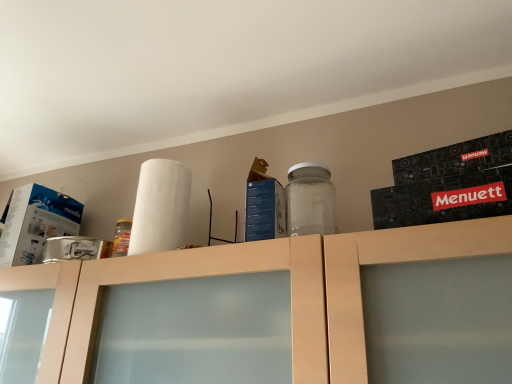
What are the coordinates of `blue cardboard box at center, which appears as the 2th box when viewed from the back` in the screenshot? It's located at (264, 205).

You are a GUI agent. You are given a task and a screenshot of the screen. Output one action in this format:
    pyautogui.click(x=<x>, y=<y>)
    Task: Click on the matte wood cabinet at upper center
    
    Given the screenshot: What is the action you would take?
    pyautogui.click(x=253, y=272)

The height and width of the screenshot is (384, 512). Identify the location of white matte paper towel at upper center. (160, 206).

The width and height of the screenshot is (512, 384). In order to click on white cardboard box at left, placed as the 1th box when sorted from back to front in this screenshot , I will do `click(36, 223)`.

The width and height of the screenshot is (512, 384). Identify the location of cabinetry that is below the white cardboard box at left, which appears as the 2th box when viewed from the front (from the image's perspective). (253, 272).

Considering the sizes of matte wood cabinet at upper center and white cardboard box at left, the first box in the left-to-right sequence, in the image, is matte wood cabinet at upper center taller or shorter than white cardboard box at left, the first box in the left-to-right sequence,?

In the image, matte wood cabinet at upper center appears to be taller than white cardboard box at left, the first box in the left-to-right sequence.

From the image's perspective, which one is positioned lower, matte wood cabinet at upper center or white cardboard box at left, placed as the 1th box when sorted from back to front?

matte wood cabinet at upper center, from the image's perspective.

Does point (309, 278) appear closer or farther from the camera than point (47, 215)?

Point (309, 278) appears to be closer to the viewer than point (47, 215).

This screenshot has height=384, width=512. What are the coordinates of `paper towel behind the blue cardboard box at center, the first box when ordered from front to back` in the screenshot? It's located at (160, 206).

Looking at the image, does white matte paper towel at upper center seem bigger or smaller compared to blue cardboard box at center, the first box when ordered from front to back?

Considering their sizes, white matte paper towel at upper center takes up more space than blue cardboard box at center, the first box when ordered from front to back.

From the picture: Who is bigger, blue cardboard box at center, which is counted as the 2th box, starting from the left, or matte wood cabinet at upper center?

With larger size is matte wood cabinet at upper center.

Considering the positions of objects blue cardboard box at center, which is counted as the 2th box, starting from the left, and matte wood cabinet at upper center in the image provided, who is more to the right, blue cardboard box at center, which is counted as the 2th box, starting from the left, or matte wood cabinet at upper center?

blue cardboard box at center, which is counted as the 2th box, starting from the left.

Who is shorter, blue cardboard box at center, which appears as the 2th box when viewed from the back, or matte wood cabinet at upper center?

Standing shorter between the two is blue cardboard box at center, which appears as the 2th box when viewed from the back.

Do you think blue cardboard box at center, which appears as the 2th box when viewed from the back, is within matte wood cabinet at upper center, or outside of it?

blue cardboard box at center, which appears as the 2th box when viewed from the back, is outside matte wood cabinet at upper center.

Who is shorter, matte wood cabinet at upper center or blue cardboard box at center, the first box from the right?

Standing shorter between the two is blue cardboard box at center, the first box from the right.

In the image, there is a blue cardboard box at center, which appears as the 2th box when viewed from the back. In order to click on cabinetry below it (from the image's perspective) in this screenshot , I will do `click(253, 272)`.

Is matte wood cabinet at upper center far away from blue cardboard box at center, which is counted as the 2th box, starting from the left?

No, matte wood cabinet at upper center is in close proximity to blue cardboard box at center, which is counted as the 2th box, starting from the left.

From a real-world perspective, relative to blue cardboard box at center, the first box when ordered from front to back, is matte wood cabinet at upper center vertically above or below?

In terms of real-world spatial position, matte wood cabinet at upper center is below blue cardboard box at center, the first box when ordered from front to back.

Which of these two, white cardboard box at left, the first box in the left-to-right sequence, or matte wood cabinet at upper center, is thinner?

white cardboard box at left, the first box in the left-to-right sequence, is thinner.

Which object is further away from the camera taking this photo, white cardboard box at left, positioned as the second box in right-to-left order, or matte wood cabinet at upper center?

white cardboard box at left, positioned as the second box in right-to-left order, is behind.

Would you say white cardboard box at left, positioned as the second box in right-to-left order, is to the left or to the right of matte wood cabinet at upper center in the picture?

From the image, it's evident that white cardboard box at left, positioned as the second box in right-to-left order, is to the left of matte wood cabinet at upper center.

From the image's perspective, which is above, white cardboard box at left, which appears as the 2th box when viewed from the front, or matte wood cabinet at upper center?

From the image's view, white cardboard box at left, which appears as the 2th box when viewed from the front, is above.

Which is more to the right, matte wood cabinet at upper center or white matte paper towel at upper center?

matte wood cabinet at upper center is more to the right.

Is matte wood cabinet at upper center in front of or behind white matte paper towel at upper center in the image?

Visually, matte wood cabinet at upper center is located in front of white matte paper towel at upper center.

From a real-world perspective, is matte wood cabinet at upper center physically below white matte paper towel at upper center?

Yes, from a real-world perspective, matte wood cabinet at upper center is under white matte paper towel at upper center.

In the scene shown: Is white cardboard box at left, placed as the 1th box when sorted from back to front, located outside blue cardboard box at center, which is counted as the 2th box, starting from the left?

Yes.

Is white cardboard box at left, which appears as the 2th box when viewed from the front, oriented towards blue cardboard box at center, the first box when ordered from front to back?

No, white cardboard box at left, which appears as the 2th box when viewed from the front, is not turned towards blue cardboard box at center, the first box when ordered from front to back.

Who is shorter, white cardboard box at left, placed as the 1th box when sorted from back to front, or blue cardboard box at center, which appears as the 2th box when viewed from the back?

With less height is blue cardboard box at center, which appears as the 2th box when viewed from the back.

Image resolution: width=512 pixels, height=384 pixels. What are the coordinates of `cabinetry that is on the right side of white cardboard box at left, placed as the 1th box when sorted from back to front` in the screenshot? It's located at (253, 272).

I want to click on paper towel on the left side of blue cardboard box at center, which appears as the 2th box when viewed from the back, so click(x=160, y=206).

In the scene shown: From the image, which object appears to be farther from white matte paper towel at upper center, matte wood cabinet at upper center or white cardboard box at left, the first box in the left-to-right sequence?

white cardboard box at left, the first box in the left-to-right sequence.

Based on their spatial positions, is blue cardboard box at center, which is counted as the 2th box, starting from the left, or matte wood cabinet at upper center closer to white matte paper towel at upper center?

Based on the image, blue cardboard box at center, which is counted as the 2th box, starting from the left, appears to be nearer to white matte paper towel at upper center.

Estimate the real-world distances between objects in this image. Which object is closer to blue cardboard box at center, the first box from the right, matte wood cabinet at upper center or white cardboard box at left, placed as the 1th box when sorted from back to front?

matte wood cabinet at upper center.

From the picture: When comparing their distances from matte wood cabinet at upper center, does white cardboard box at left, the first box in the left-to-right sequence, or white matte paper towel at upper center seem further?

Among the two, white cardboard box at left, the first box in the left-to-right sequence, is located further to matte wood cabinet at upper center.

Estimate the real-world distances between objects in this image. Which object is further from blue cardboard box at center, which appears as the 2th box when viewed from the back, white cardboard box at left, the first box in the left-to-right sequence, or white matte paper towel at upper center?

white cardboard box at left, the first box in the left-to-right sequence, is further to blue cardboard box at center, which appears as the 2th box when viewed from the back.

Considering their positions, is matte wood cabinet at upper center positioned further to white cardboard box at left, the first box in the left-to-right sequence, than white matte paper towel at upper center?

Based on the image, white matte paper towel at upper center appears to be further to white cardboard box at left, the first box in the left-to-right sequence.

Considering their positions, is white cardboard box at left, positioned as the second box in right-to-left order, positioned closer to matte wood cabinet at upper center than blue cardboard box at center, which appears as the 2th box when viewed from the back?

Among the two, blue cardboard box at center, which appears as the 2th box when viewed from the back, is located nearer to matte wood cabinet at upper center.

Considering their positions, is white cardboard box at left, positioned as the second box in right-to-left order, positioned further to white matte paper towel at upper center than blue cardboard box at center, the first box from the right?

white cardboard box at left, positioned as the second box in right-to-left order, lies further to white matte paper towel at upper center than the other object.

You are a GUI agent. You are given a task and a screenshot of the screen. Output one action in this format:
    pyautogui.click(x=<x>, y=<y>)
    Task: Click on the cabinetry between white cardboard box at left, the first box in the left-to-right sequence, and blue cardboard box at center, the first box from the right
    The height and width of the screenshot is (384, 512).
    Given the screenshot: What is the action you would take?
    pyautogui.click(x=253, y=272)

Find the location of a particular element. The image size is (512, 384). paper towel between white cardboard box at left, the first box in the left-to-right sequence, and blue cardboard box at center, which is counted as the 2th box, starting from the left, from left to right is located at coordinates (160, 206).

The height and width of the screenshot is (384, 512). In order to click on paper towel between matte wood cabinet at upper center and white cardboard box at left, positioned as the second box in right-to-left order, from front to back in this screenshot , I will do `click(160, 206)`.

Find the location of a particular element. This screenshot has width=512, height=384. box between matte wood cabinet at upper center and white matte paper towel at upper center along the z-axis is located at coordinates (264, 205).